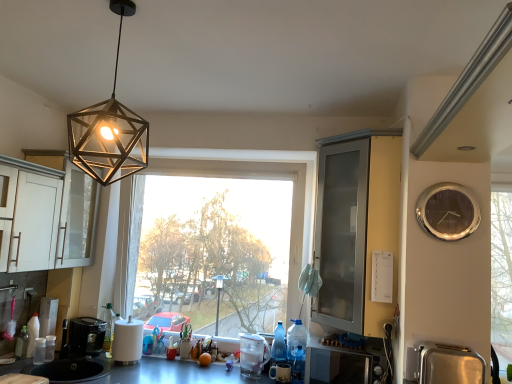
Question: Looking at the image, does metallic hexagonal light fixture at upper center seem bigger or smaller compared to metallic gray countertop at lower center?

Choices:
 (A) small
 (B) big

Answer: (A)

Question: Would you say metallic hexagonal light fixture at upper center is to the left or to the right of metallic gray countertop at lower center in the picture?

Choices:
 (A) right
 (B) left

Answer: (A)

Question: Which is farther from the translucent blue bottle at lower center, which ranks as the 2th bottle in left-to-right order?

Choices:
 (A) clear glass cabinet at right
 (B) white glossy microwave at lower center, the third appliance from the left
 (C) transparent glass window at center
 (D) clear plastic blender at center, placed as the third appliance when sorted from front to back
 (E) metallic gray countertop at lower center

Answer: (C)

Question: Based on their relative distances, which object is farther from the clear glass cabinet at right?

Choices:
 (A) white glossy microwave at lower center, which is counted as the third appliance, starting from the back
 (B) translucent blue bottle at lower center, the 1th bottle positioned from the front
 (C) translucent plastic bottle at lower left, placed as the 2th bottle when sorted from right to left
 (D) silver metallic exhaust hood at upper right
 (E) black plastic coffee machine at lower left

Answer: (C)